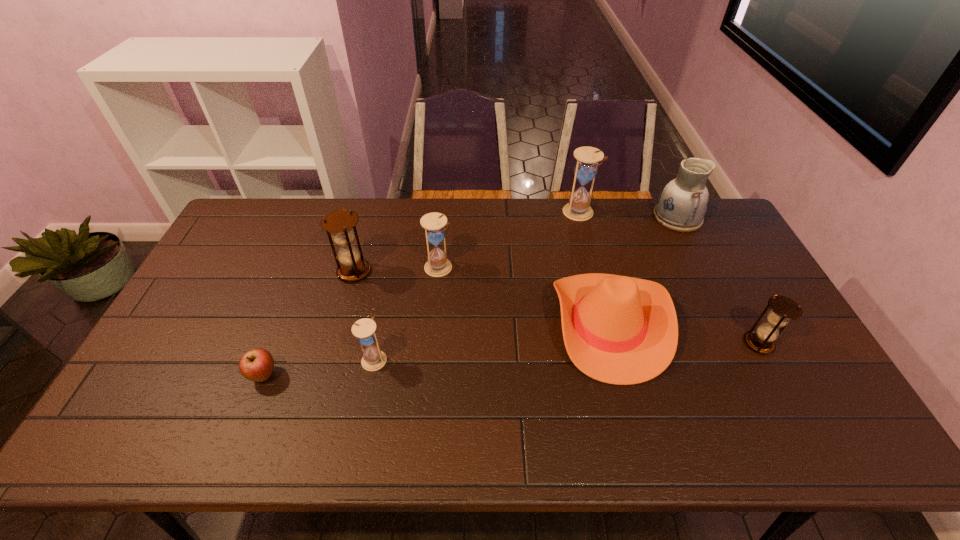
Where is `free space at the far left corner of the desktop`? The width and height of the screenshot is (960, 540). free space at the far left corner of the desktop is located at coordinates (285, 204).

This screenshot has width=960, height=540. What are the coordinates of `unoccupied area between the blue pottery and the cowboy hat` in the screenshot? It's located at (642, 271).

You are a GUI agent. You are given a task and a screenshot of the screen. Output one action in this format:
    pyautogui.click(x=<x>, y=<y>)
    Task: Click on the vacant area that lies between the leftmost object and the tallest hourglass
    This screenshot has height=540, width=960.
    Given the screenshot: What is the action you would take?
    pyautogui.click(x=420, y=294)

Where is `free space between the leftmost object and the fourth object from left to right`? Image resolution: width=960 pixels, height=540 pixels. free space between the leftmost object and the fourth object from left to right is located at coordinates (351, 321).

The height and width of the screenshot is (540, 960). What are the coordinates of `vacant point located between the fourth hourglass from right to left and the cowboy hat` in the screenshot? It's located at (491, 341).

You are a GUI agent. You are given a task and a screenshot of the screen. Output one action in this format:
    pyautogui.click(x=<x>, y=<y>)
    Task: Click on the free space between the right brown hourglass and the blue pottery
    This screenshot has height=540, width=960.
    Given the screenshot: What is the action you would take?
    pyautogui.click(x=718, y=281)

Locate an element on the screen. free spot between the cowboy hat and the apple is located at coordinates (436, 349).

Identify the location of vacant area that lies between the second nearest white hourglass and the cowboy hat. This screenshot has height=540, width=960. (523, 295).

Identify the location of vacant region between the farther brown hourglass and the leftmost object. The height and width of the screenshot is (540, 960). (309, 323).

Where is `blank region between the second nearest white hourglass and the blue pottery`? blank region between the second nearest white hourglass and the blue pottery is located at coordinates (559, 242).